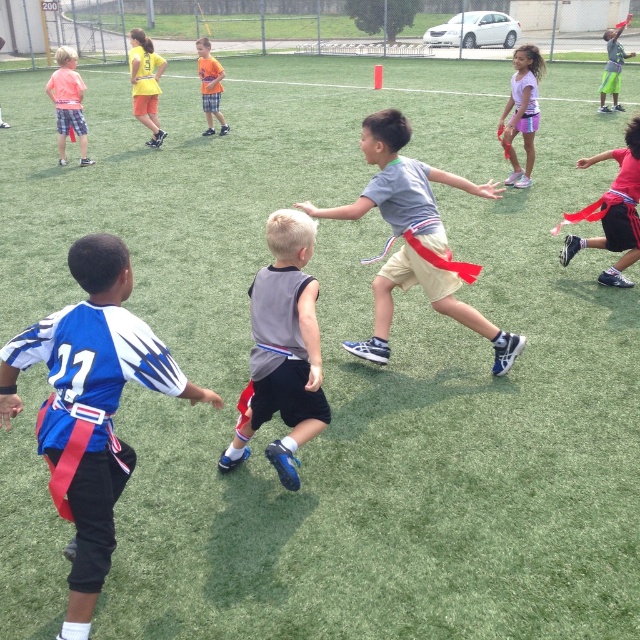
Is blue jersey at center to the left of orange fabric flag at center from the viewer's perspective?

No, blue jersey at center is not to the left of orange fabric flag at center.

Is point (8, 413) positioned behind point (205, 92)?

That is False.

The image size is (640, 640). I want to click on blue jersey at center, so click(x=90, y=406).

Does gray fabric shirt at center have a larger size compared to purple fabric flag at upper right?

Actually, gray fabric shirt at center might be smaller than purple fabric flag at upper right.

Does gray fabric shirt at center have a greater height compared to purple fabric flag at upper right?

In fact, gray fabric shirt at center may be shorter than purple fabric flag at upper right.

Which is behind, point (385, 362) or point (529, 68)?

Point (529, 68)

Locate an element on the screen. Image resolution: width=640 pixels, height=640 pixels. gray fabric shirt at center is located at coordinates (413, 237).

Is point (88, 474) positioned in front of point (298, 385)?

That is True.

Does blue jersey at center appear under gray matte tank top at center?

Yes, blue jersey at center is below gray matte tank top at center.

Image resolution: width=640 pixels, height=640 pixels. In order to click on blue jersey at center in this screenshot , I will do tap(90, 406).

Locate an element on the screen. The width and height of the screenshot is (640, 640). blue jersey at center is located at coordinates (90, 406).